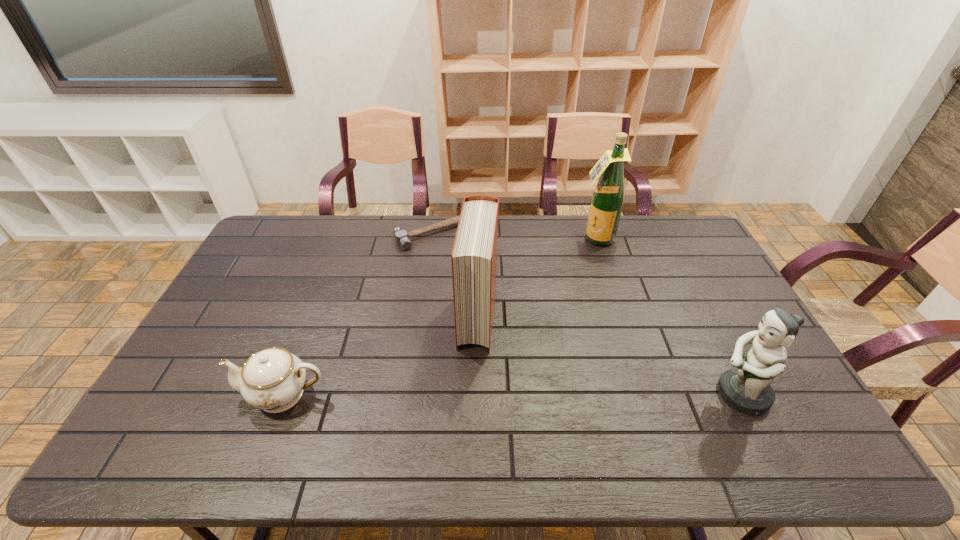
Image resolution: width=960 pixels, height=540 pixels. I want to click on empty space that is in between the figurine and the liquor, so click(668, 316).

The image size is (960, 540). What are the coordinates of `object that is the closest to the hammer` in the screenshot? It's located at (474, 255).

Locate an element on the screen. Image resolution: width=960 pixels, height=540 pixels. object that stands as the second closest to the chinaware is located at coordinates (401, 236).

Find the location of `free space that satisfies the following two spatial constraints: 1. on the front side of the shortest object; 2. on the front-facing side of the third shortest object`. free space that satisfies the following two spatial constraints: 1. on the front side of the shortest object; 2. on the front-facing side of the third shortest object is located at coordinates (416, 394).